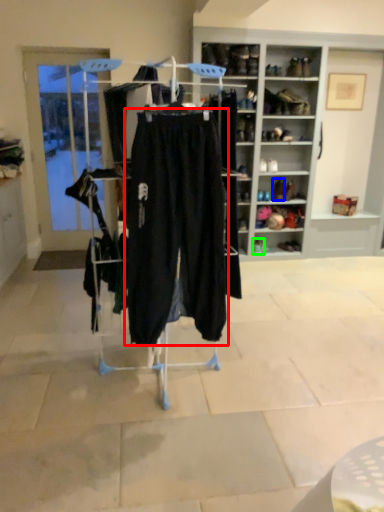
Question: Which is farther away from trousers (highlighted by a red box)? footwear (highlighted by a blue box) or footwear (highlighted by a green box)?

Choices:
 (A) footwear
 (B) footwear

Answer: (A)